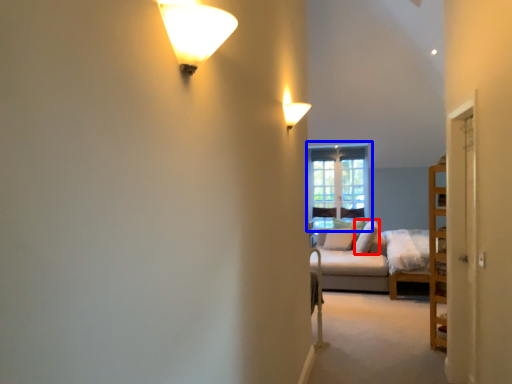
Question: Which point is further to the camera, pillow (highlighted by a red box) or window (highlighted by a blue box)?

Choices:
 (A) pillow
 (B) window

Answer: (B)